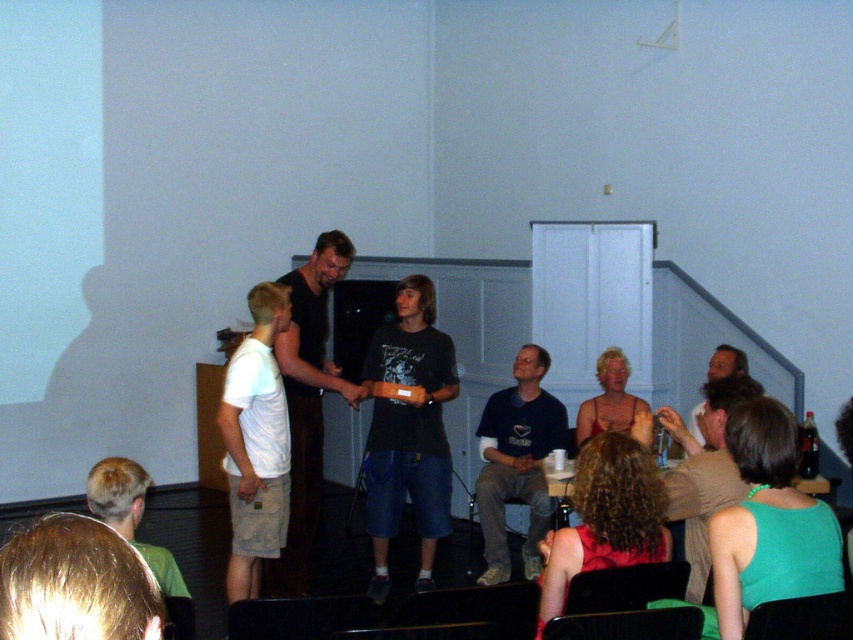
You are organizing a photo shoot in this room and want to position a large camera between the green fabric tank top at lower right and the curly hair at lower center. Based on their sizes, will the camera fit comfortably between them?

The green fabric tank top at lower right is smaller than curly hair at lower center. Since the camera needs space between them, the size difference might affect placement, but without exact measurements, it is uncertain. However, the description only states size comparison, so the answer should focus on that. The camera may fit if the space between them accommodates the camera, but the size comparison alone doesn not confirm it. Wait, the objects description says the tank top is smaller than the curly hair.

You are an event organizer who needs to adjust seating to ensure all attendees can see the presenter. The dark blue denim shorts at center and the green fabric tank top at lower right are two attendees in your line of sight. Which attendee is sitting closer to the front of the room?

The dark blue denim shorts at center is located below green fabric tank top at lower right, meaning it is closer to the front of the room.

You are standing at the entrance of the room and see the point marked at coordinate (769, 524). What is the object located at that point?

The point at coordinate (769, 524) marks the green fabric tank top at lower right.